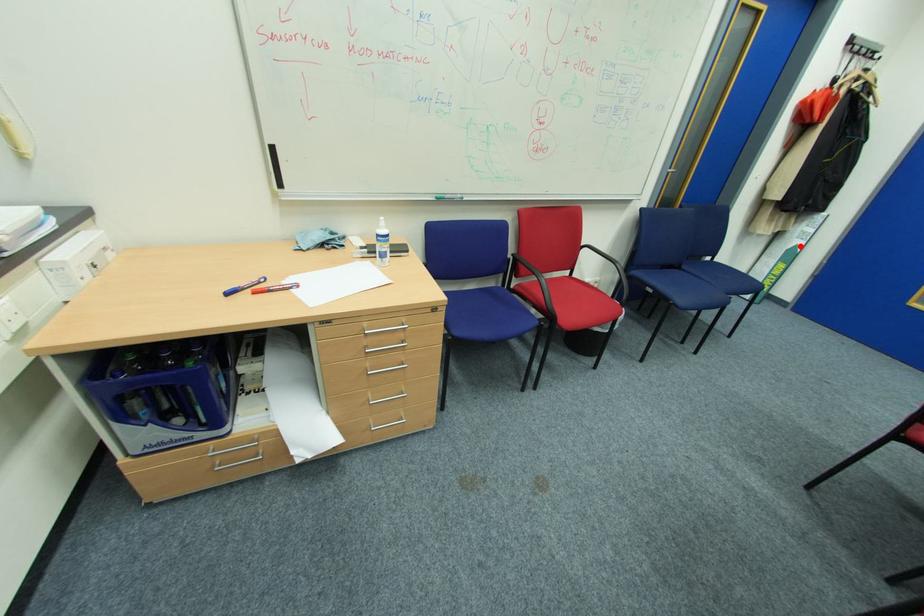
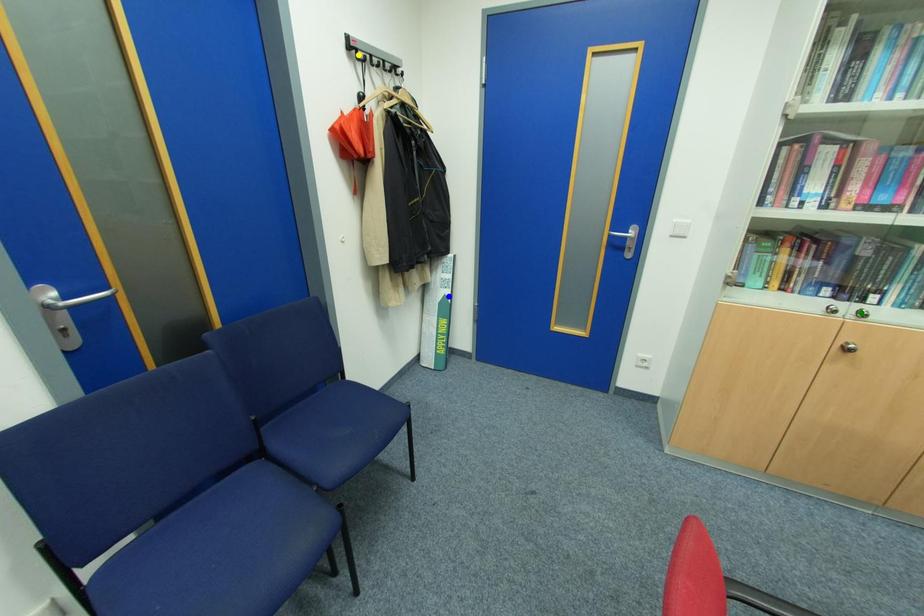
Question: I am providing you with two images of the same scene from different viewpoints. A red point is marked on the first image. You are given multiple points on the second image. Which spot in image 2 lines up with the point in image 1?

Choices:
 (A) blue point
 (B) yellow point
 (C) green point

Answer: (A)